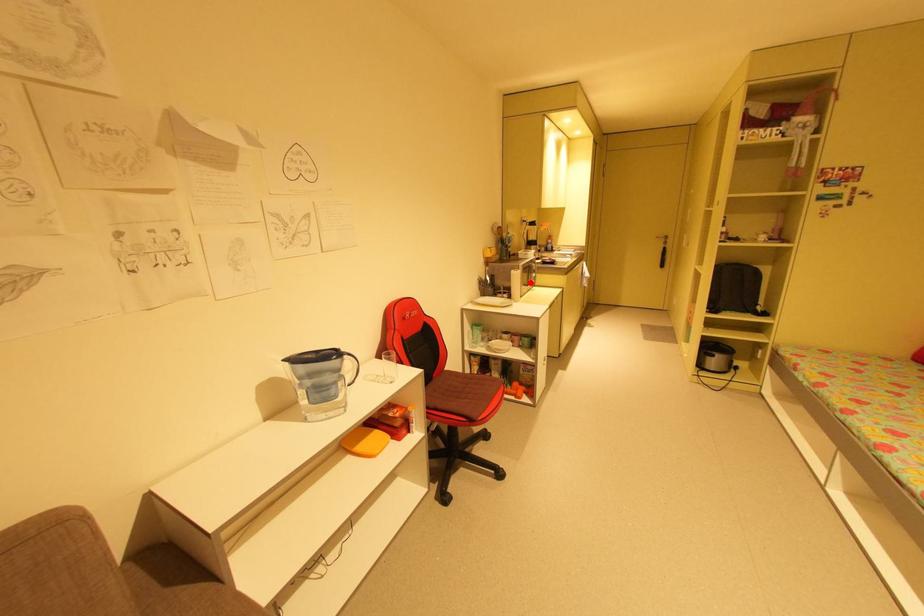
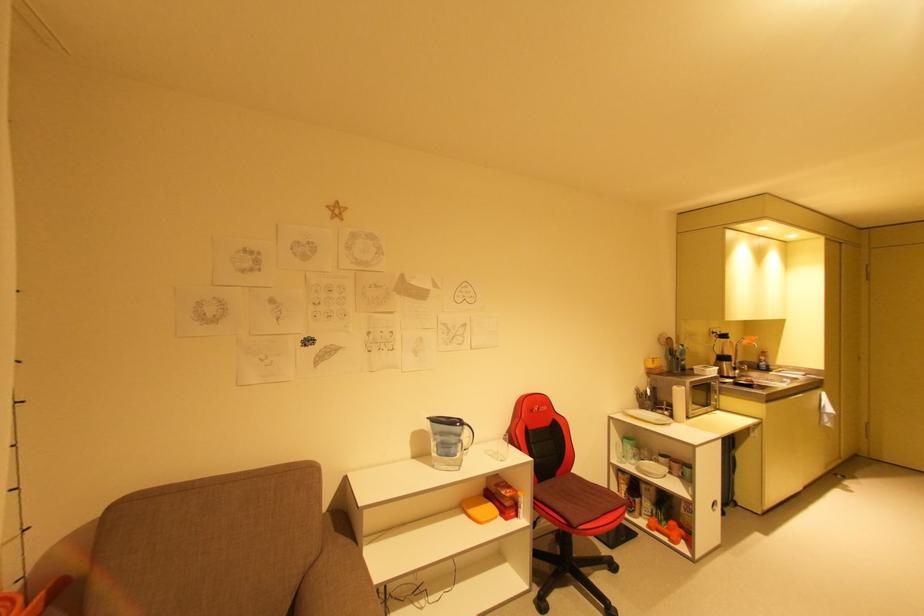
Find the pixel in the second image that matches the highlighted location in the first image.

(708, 403)